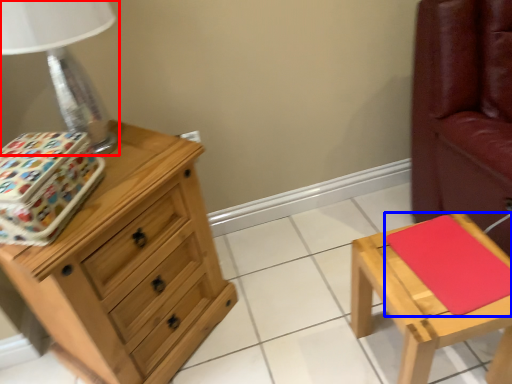
Question: Which object is closer to the camera taking this photo, table lamp (highlighted by a red box) or pad (highlighted by a blue box)?

Choices:
 (A) table lamp
 (B) pad

Answer: (A)